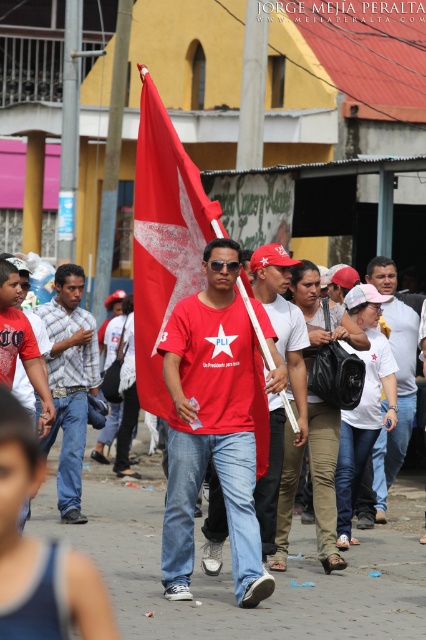
Question: Can you confirm if plaid shirt at center is positioned above matte red cap at center?

Choices:
 (A) yes
 (B) no

Answer: (B)

Question: Which of the following is the farthest from the observer?

Choices:
 (A) red fabric flag at center
 (B) matte red cap at center
 (C) plaid shirt at center
 (D) matte red t-shirt at center

Answer: (C)

Question: Can you confirm if matte red cap at center is smaller than white matte shirt at center?

Choices:
 (A) yes
 (B) no

Answer: (A)

Question: Among these objects, which one is farthest from the camera?

Choices:
 (A) matte red cap at center
 (B) matte red t-shirt at center
 (C) white matte shirt at center
 (D) red fabric flag at center

Answer: (C)

Question: Observing the image, what is the correct spatial positioning of matte red t-shirt at center in reference to white matte shirt at center?

Choices:
 (A) right
 (B) left

Answer: (B)

Question: Among these points, which one is nearest to the camera?

Choices:
 (A) (382, 470)
 (B) (238, 442)
 (C) (48, 337)
 (D) (298, 310)

Answer: (B)